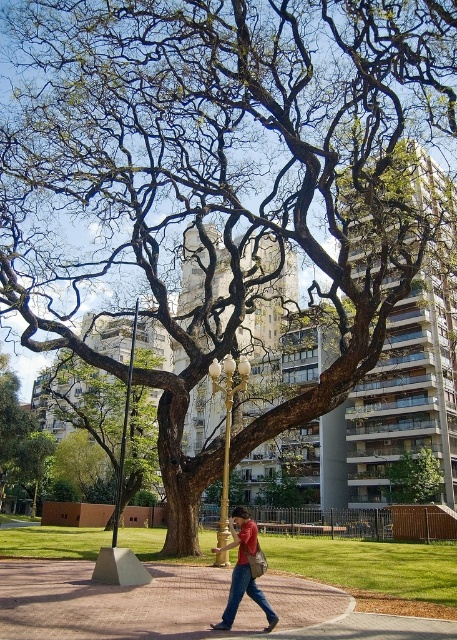
You are standing in the park and want to walk towards the tree. Since the paved brick sidewalk at center and the smooth brown tree trunk at center are both in your path, which one would you step on to reach the tree?

The paved brick sidewalk at center is located above the smooth brown tree trunk at center, so you would step on the paved brick sidewalk at center to reach the tree.

You are standing at the edge of the park and see the paved brick sidewalk at center and the matte red shirt at center. Which object is positioned to the left when viewed from your perspective?

The paved brick sidewalk at center is to the left of the matte red shirt at center from your perspective.

You are an observer in the park. You notice the matte red shirt at center and the green leafy tree at center. Which object takes up more space in the image?

The green leafy tree at center takes up more space in the image than the matte red shirt at center.